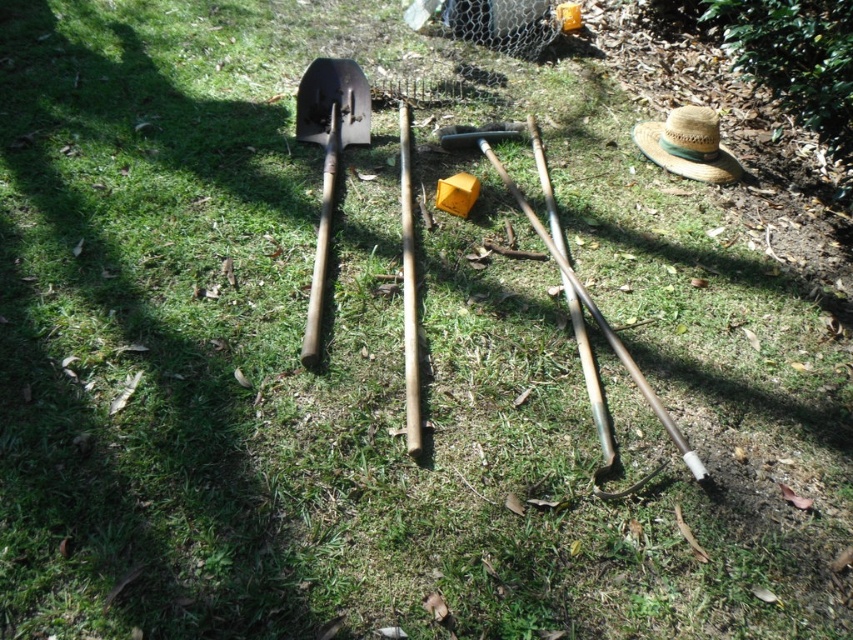
Question: Is wooden shovel at center positioned in front of wooden baseball bat at center?

Choices:
 (A) no
 (B) yes

Answer: (A)

Question: Can you confirm if wooden shovel at center is thinner than straw hat at lower right?

Choices:
 (A) yes
 (B) no

Answer: (A)

Question: Which of these objects is positioned closest to the wooden baseball bat at center?

Choices:
 (A) wooden shovel at center
 (B) straw hat at lower right

Answer: (A)

Question: Which object appears closest to the camera in this image?

Choices:
 (A) wooden shovel at center
 (B) wooden baseball bat at center
 (C) straw hat at lower right

Answer: (B)

Question: Estimate the real-world distances between objects in this image. Which object is farther from the straw hat at lower right?

Choices:
 (A) wooden baseball bat at center
 (B) wooden shovel at center

Answer: (B)

Question: Can you confirm if wooden shovel at center is bigger than wooden baseball bat at center?

Choices:
 (A) no
 (B) yes

Answer: (B)